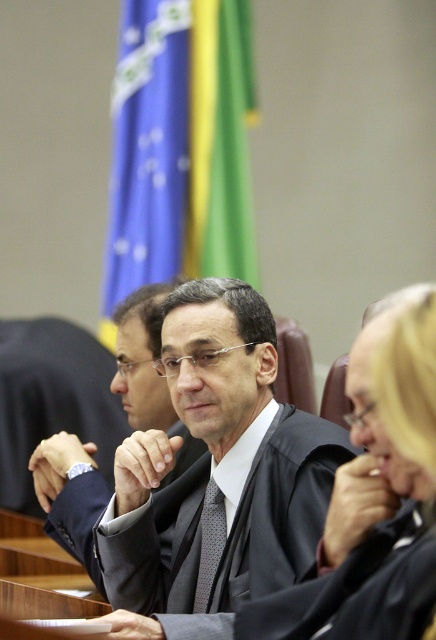
Question: Does black matte judge at center appear over black textured tie at center?

Choices:
 (A) yes
 (B) no

Answer: (A)

Question: Does smooth black robe at center appear on the left side of black textured tie at center?

Choices:
 (A) yes
 (B) no

Answer: (B)

Question: Which point is closer to the camera?

Choices:
 (A) (126, 556)
 (B) (399, 602)
 (C) (201, 515)
 (D) (125, 385)

Answer: (B)

Question: Can you confirm if smooth black robe at center is positioned to the right of black matte suit at center?

Choices:
 (A) no
 (B) yes

Answer: (B)

Question: Which object appears farthest from the camera in this image?

Choices:
 (A) black textured tie at center
 (B) black matte judge at center
 (C) black matte suit at center
 (D) smooth black robe at center

Answer: (C)

Question: Estimate the real-world distances between objects in this image. Which object is farther from the black textured tie at center?

Choices:
 (A) smooth black robe at center
 (B) black matte judge at center
 (C) black matte suit at center

Answer: (A)